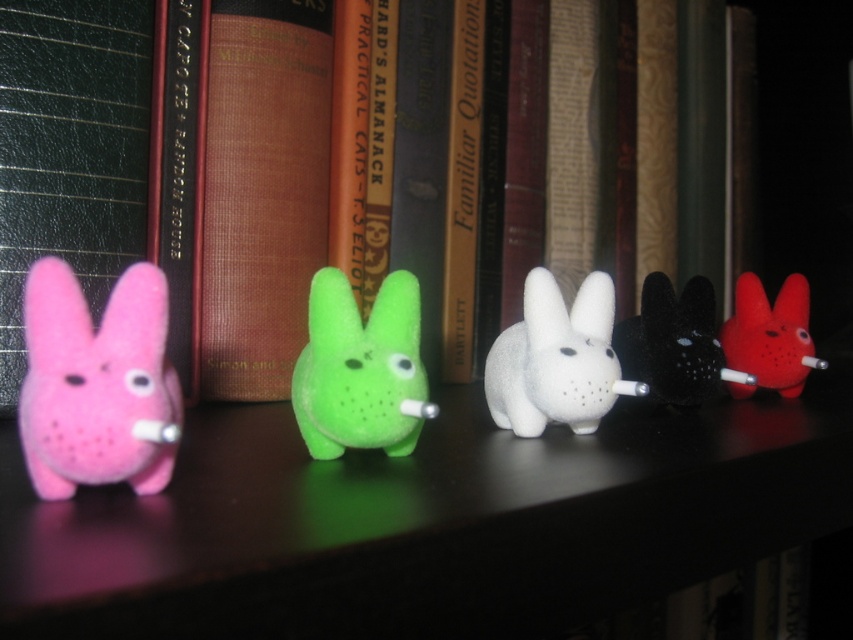
Identify the location of pink felt bunny at left. This screenshot has width=853, height=640. (70, 150).

Does pink felt bunny at left appear over white matte rabbit at center?

Indeed, pink felt bunny at left is positioned over white matte rabbit at center.

Between point (16, 172) and point (610, 333), which one is positioned in front?

Point (610, 333)

Locate an element on the screen. pink felt bunny at left is located at coordinates (70, 150).

Is green fuzzy bunny at center to the right of white matte rabbit at center from the viewer's perspective?

In fact, green fuzzy bunny at center is to the left of white matte rabbit at center.

Locate an element on the screen. green fuzzy bunny at center is located at coordinates (358, 368).

You are a GUI agent. You are given a task and a screenshot of the screen. Output one action in this format:
    pyautogui.click(x=<x>, y=<y>)
    Task: Click on the green fuzzy bunny at center
    
    Given the screenshot: What is the action you would take?
    pyautogui.click(x=358, y=368)

Can you confirm if matte pink plush at left is smaller than black fuzzy bunny at center?

Correct, matte pink plush at left occupies less space than black fuzzy bunny at center.

Image resolution: width=853 pixels, height=640 pixels. Describe the element at coordinates (97, 384) in the screenshot. I see `matte pink plush at left` at that location.

Locate an element on the screen. The image size is (853, 640). matte pink plush at left is located at coordinates (97, 384).